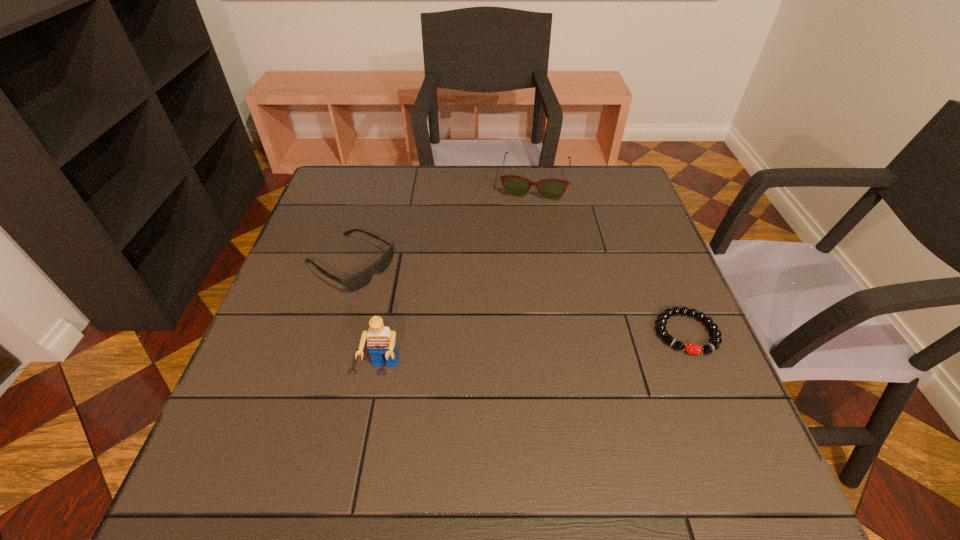
You are a GUI agent. You are given a task and a screenshot of the screen. Output one action in this format:
    pyautogui.click(x=<x>, y=<y>)
    Task: Click on the free spot at the right edge of the desktop
    Image resolution: width=960 pixels, height=540 pixels.
    Given the screenshot: What is the action you would take?
    pyautogui.click(x=633, y=257)

The width and height of the screenshot is (960, 540). In the image, there is a desktop. Identify the location of vacant space at the far right corner. (618, 167).

The width and height of the screenshot is (960, 540). What are the coordinates of `free space between the rightmost object and the spectacles` in the screenshot? It's located at (611, 258).

The image size is (960, 540). Find the location of `free space that is in between the third object from left to right and the bracelet`. free space that is in between the third object from left to right and the bracelet is located at coordinates (611, 258).

Where is `unoccupied area between the tallest object and the bracelet`? unoccupied area between the tallest object and the bracelet is located at coordinates (536, 351).

Find the location of a particular element. The width and height of the screenshot is (960, 540). free spot between the tallest object and the sunglasses is located at coordinates (367, 317).

The width and height of the screenshot is (960, 540). Find the location of `free space between the second farthest object and the tallest object`. free space between the second farthest object and the tallest object is located at coordinates (367, 317).

At what (x,y) coordinates should I click in order to perform the action: click on vacant point located between the farthest object and the tallest object. Please return your answer as a coordinate pair (x, y). Looking at the image, I should click on (459, 276).

This screenshot has height=540, width=960. I want to click on vacant region between the second tallest object and the second farthest object, so click(x=443, y=224).

The height and width of the screenshot is (540, 960). In order to click on vacant area between the shortest object and the third nearest object in this screenshot , I will do `click(518, 299)`.